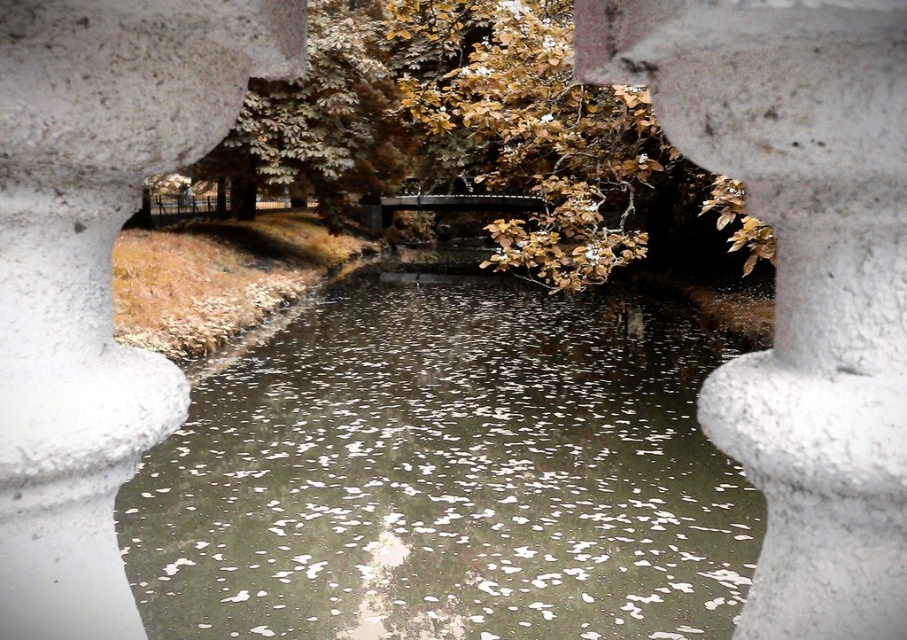
You are an architect designing a new garden and want to incorporate elements from this scene. If you want to ensure the greenish reflective water at center and the white stone pillar at center are visible from a central viewing point, which element should be placed farther away to maintain their visibility?

The greenish reflective water at center should be placed farther away since it is larger in size than the white stone pillar at center, ensuring both elements remain visible from the central viewing point.